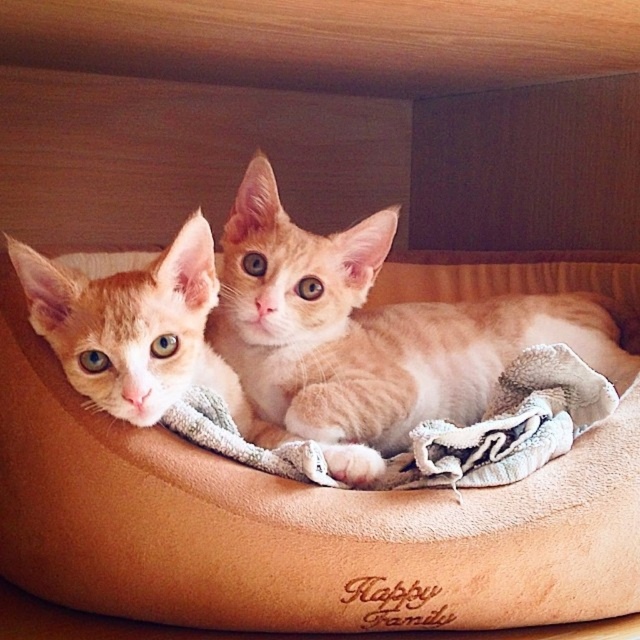
You are a cat owner who wants to place a new toy between the beige suede cat bed at center and the orange fur kitten at left. Based on the scene, where should you place the toy to ensure it is between both objects?

The beige suede cat bed at center is positioned on the right side of orange fur kitten at left, so you should place the toy to the right of the orange fur kitten at left and to the left of the beige suede cat bed at center to ensure it is between both objects.

You are a cat owner who wants to ensure your orange fur cat at center has enough space to stretch out on the beige suede cat bed at center. Based on the scene, can the cat comfortably stretch out on the bed?

The beige suede cat bed at center is in front of orange fur cat at center, but this detail does not provide information about the bed size. Please check the bed dimensions or observe if the cat has enough space in the image.

You are looking at the image of two kittens in a circular pet bed. The orange fur cat at center and the orange fur kitten at left are positioned in a specific way. Which one is located lower in the image?

The orange fur cat at center is below orange fur kitten at left, so the orange fur cat at center is positioned lower in the image.